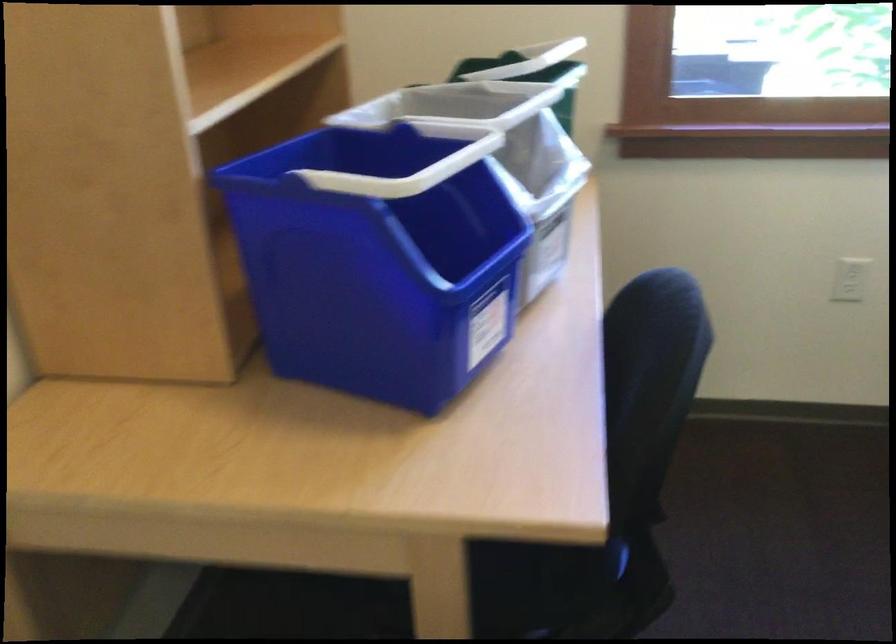
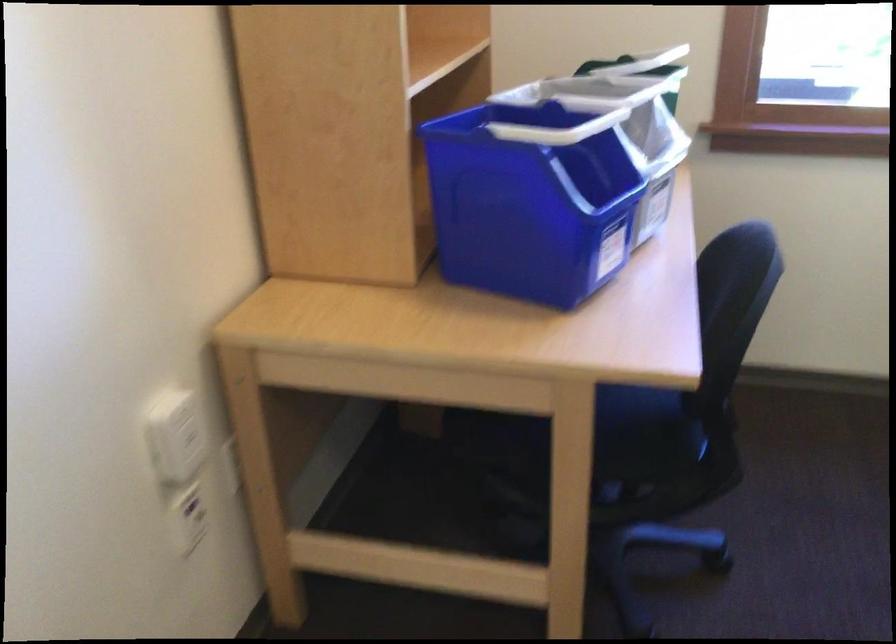
Question: The camera is either moving clockwise (left) or counter-clockwise (right) around the object. The first image is from the beginning of the video and the second image is from the end. Is the camera moving left or right when shooting the video?

Choices:
 (A) Left
 (B) Right

Answer: (B)